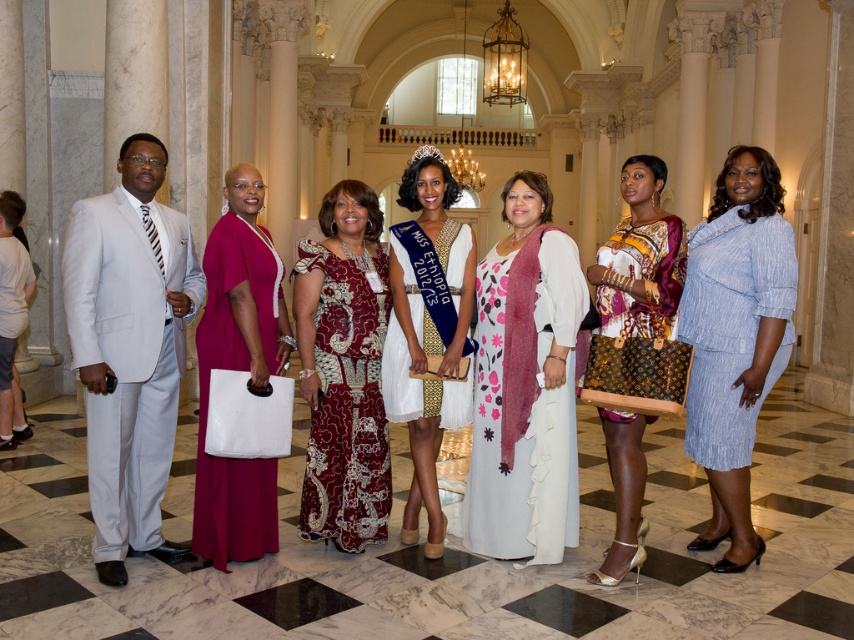
Question: Which point is farther to the camera?

Choices:
 (A) pos(106,225)
 (B) pos(629,541)

Answer: (B)

Question: Which object appears farthest from the camera in this image?

Choices:
 (A) light gray suit at left
 (B) printed silk dress at center

Answer: (B)

Question: Which of the following is the farthest from the observer?

Choices:
 (A) light blue textured dress at right
 (B) maroon satin dress at center
 (C) matte pink dress at center
 (D) printed silk dress at center

Answer: (B)

Question: Observing the image, what is the correct spatial positioning of maroon satin dress at center in reference to printed silk dress at center?

Choices:
 (A) left
 (B) right

Answer: (A)

Question: Is floral-patterned dress at center positioned before maroon satin dress at center?

Choices:
 (A) yes
 (B) no

Answer: (B)

Question: Can you confirm if floral-patterned dress at center is positioned above printed fabric dress at center?

Choices:
 (A) yes
 (B) no

Answer: (A)